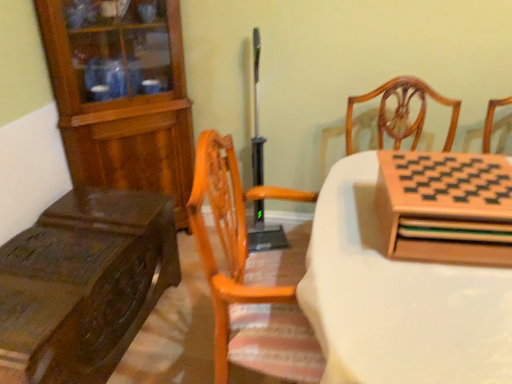
Identify the location of empty space that is ontop of dark brown wood table at left, the first table positioned from the left (from a real-world perspective). This screenshot has width=512, height=384. (67, 254).